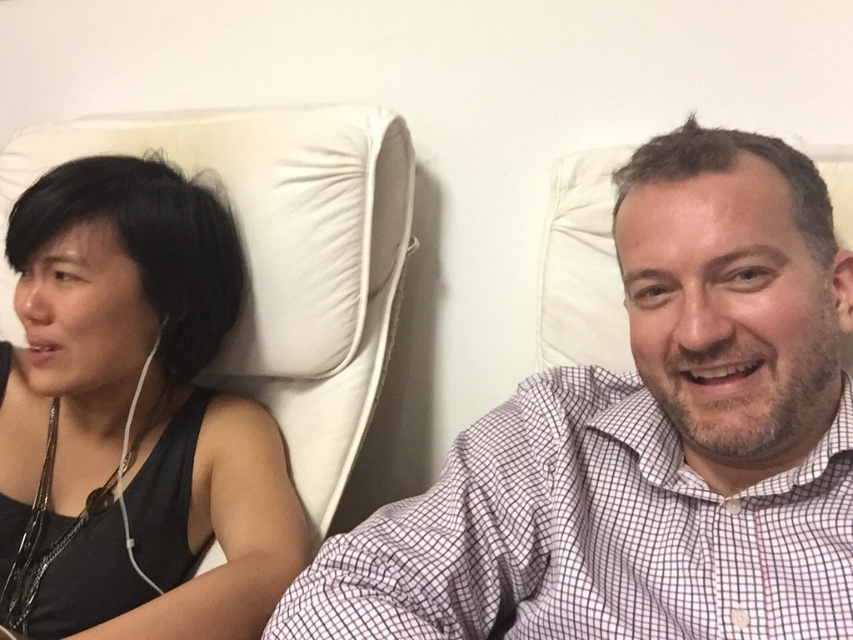
Question: Where is white checkered shirt at center located in relation to black fabric tank top at left in the image?

Choices:
 (A) below
 (B) above

Answer: (A)

Question: Which point appears farthest from the camera in this image?

Choices:
 (A) (148, 609)
 (B) (548, 444)

Answer: (A)

Question: Is white checkered shirt at center in front of black fabric tank top at left?

Choices:
 (A) no
 (B) yes

Answer: (B)

Question: Does white checkered shirt at center lie behind black fabric tank top at left?

Choices:
 (A) yes
 (B) no

Answer: (B)